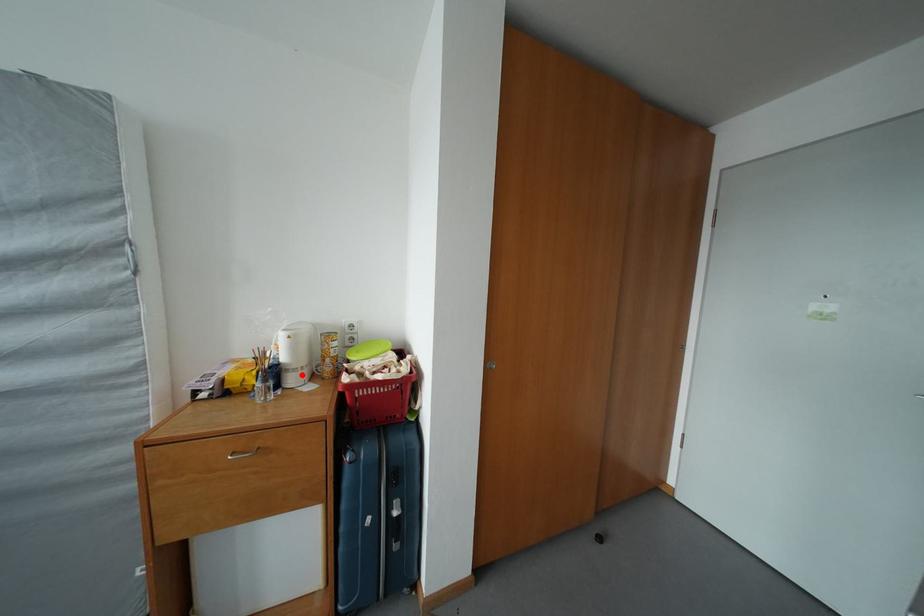
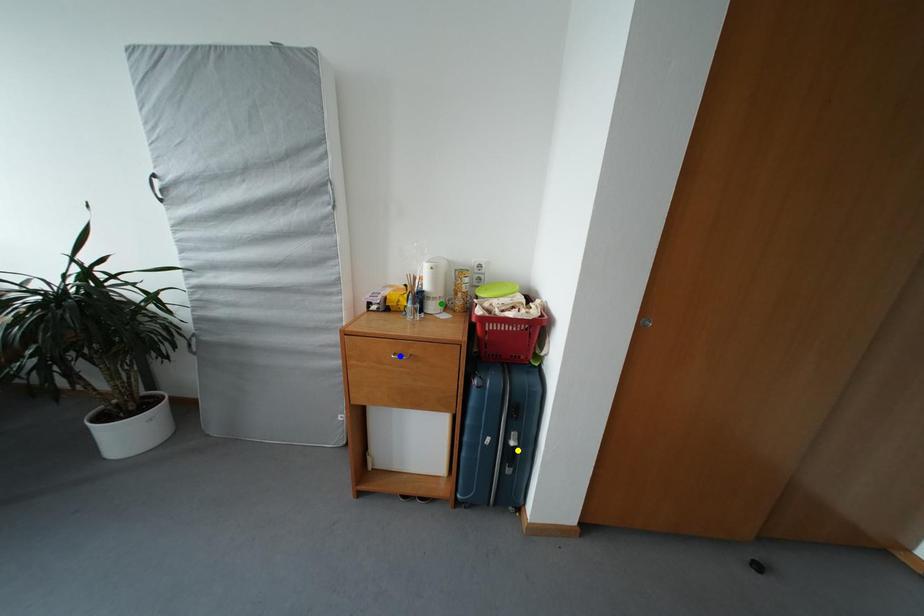
Question: I am providing you with two images of the same scene from different viewpoints. A red point is marked on the first image. You are given multiple points on the second image. Can you choose the point in image 2 that corresponds to the point in image 1?

Choices:
 (A) green point
 (B) blue point
 (C) yellow point

Answer: (A)